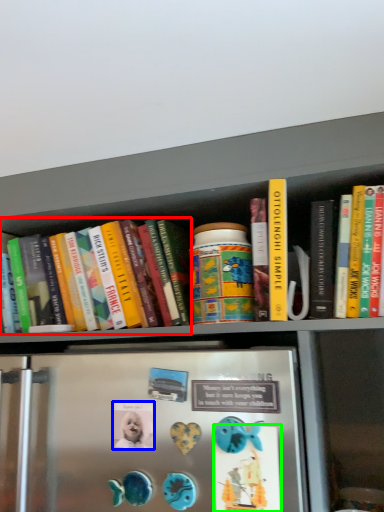
Question: Estimate the real-world distances between objects in this image. Which object is closer to book (highlighted by a red box), button (highlighted by a blue box) or button (highlighted by a green box)?

Choices:
 (A) button
 (B) button

Answer: (A)